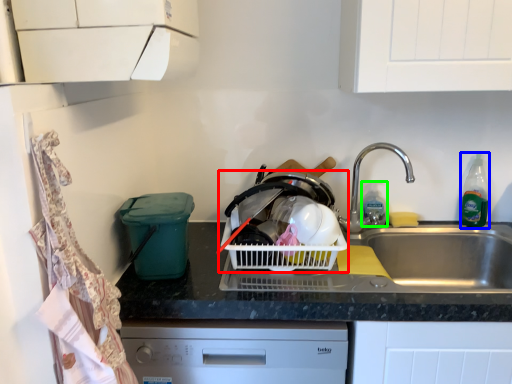
Question: Which is farther away from basket container (highlighted by a red box)? bottle (highlighted by a blue box) or bottle (highlighted by a green box)?

Choices:
 (A) bottle
 (B) bottle

Answer: (A)